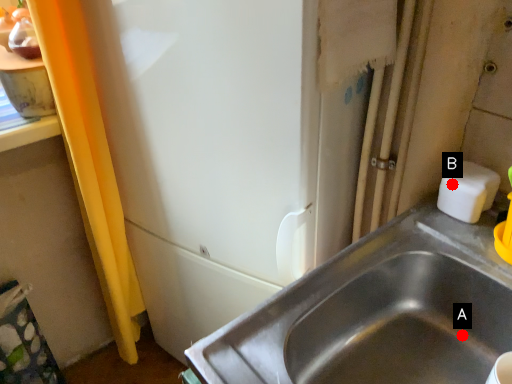
Question: Two points are circled on the image, labeled by A and B beside each circle. Which point is further to the camera?

Choices:
 (A) A is further
 (B) B is further

Answer: (B)